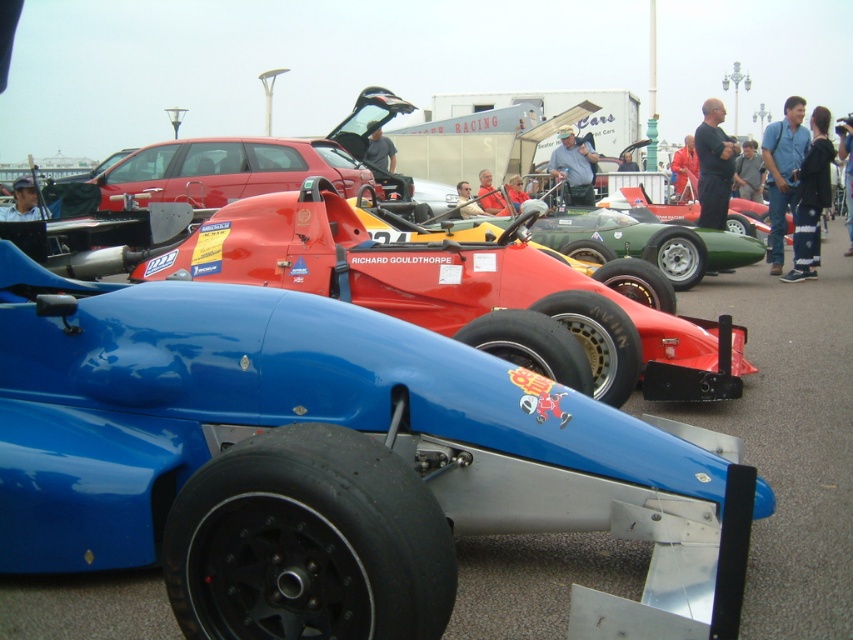
You are a photographer at a car show and want to capture both the shiny red racing car at center and the matte red car at center in a single shot. Which car should you focus on first to ensure both are in frame?

The shiny red racing car at center is located below the matte red car at center. To capture both in a single shot, focus on the matte red car at center first, as it is higher up, ensuring the lower positioned shiny red racing car at center will also be included in the frame.

You are standing in front of the racing car display and want to know which of the two points, point [523,518] or point [328,147], is nearer to you. Based on the image, which one is closer?

Point [523,518] is closer to the viewer than point [328,147].